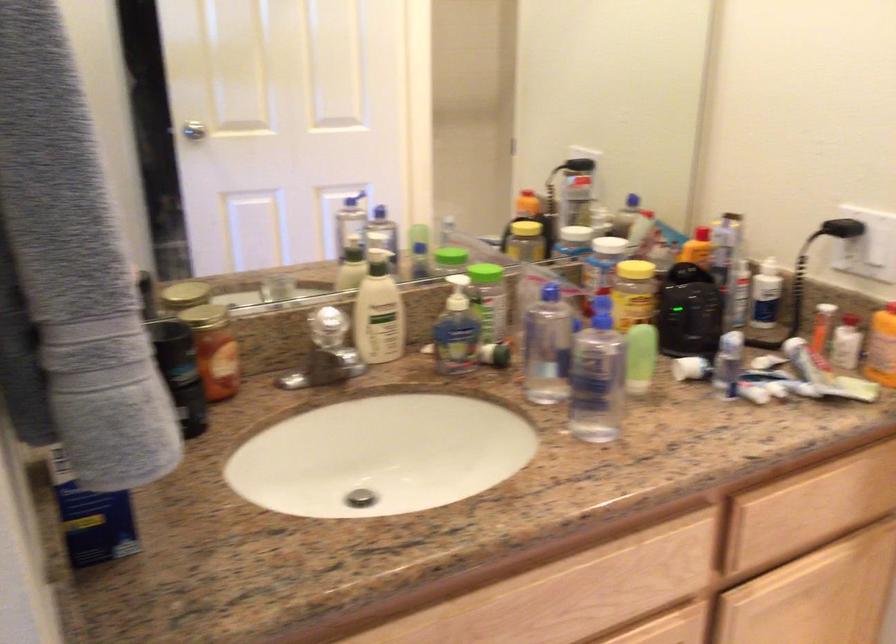
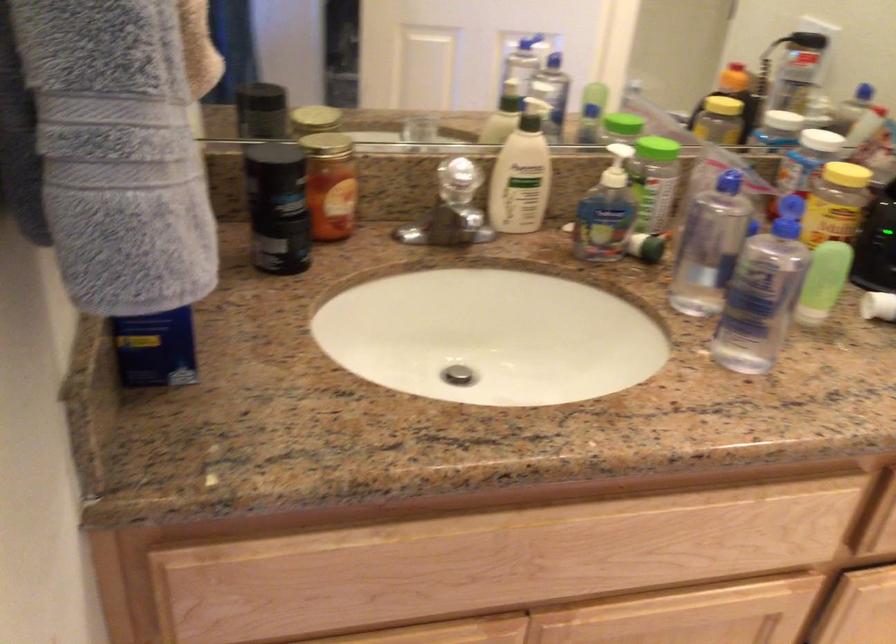
Question: The images are taken continuously from a first-person perspective. In which direction are you moving?

Choices:
 (A) Left
 (B) Right
 (C) Forward
 (D) Backward

Answer: (C)